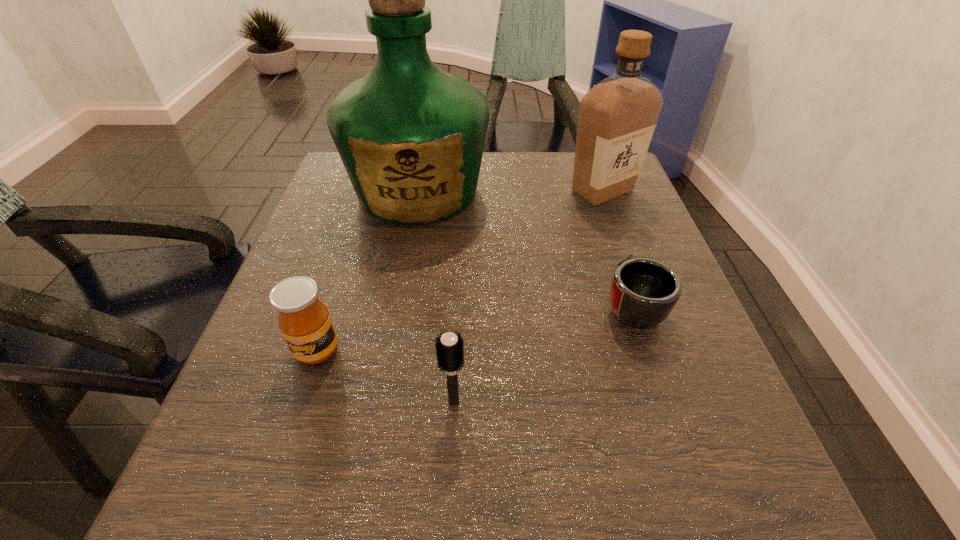
This screenshot has width=960, height=540. Find the location of `the taller liquor`. the taller liquor is located at coordinates (411, 137).

This screenshot has height=540, width=960. Find the location of `the left liquor`. the left liquor is located at coordinates (411, 137).

This screenshot has width=960, height=540. I want to click on the shorter liquor, so click(x=617, y=117).

Find the location of a particular element. the second tallest object is located at coordinates [x=617, y=117].

The height and width of the screenshot is (540, 960). Identify the location of the nearest object. (449, 347).

The image size is (960, 540). In order to click on honey in this screenshot , I will do `click(304, 320)`.

Locate an element on the screen. The image size is (960, 540). mug is located at coordinates (643, 292).

The height and width of the screenshot is (540, 960). I want to click on vacant area situated on the label side of the taller liquor, so 385,373.

Find the location of `vacant space located 0.270m on the front-facing side of the right liquor`. vacant space located 0.270m on the front-facing side of the right liquor is located at coordinates (640, 298).

The width and height of the screenshot is (960, 540). I want to click on vacant position located on the right of the nearest object, so click(x=555, y=402).